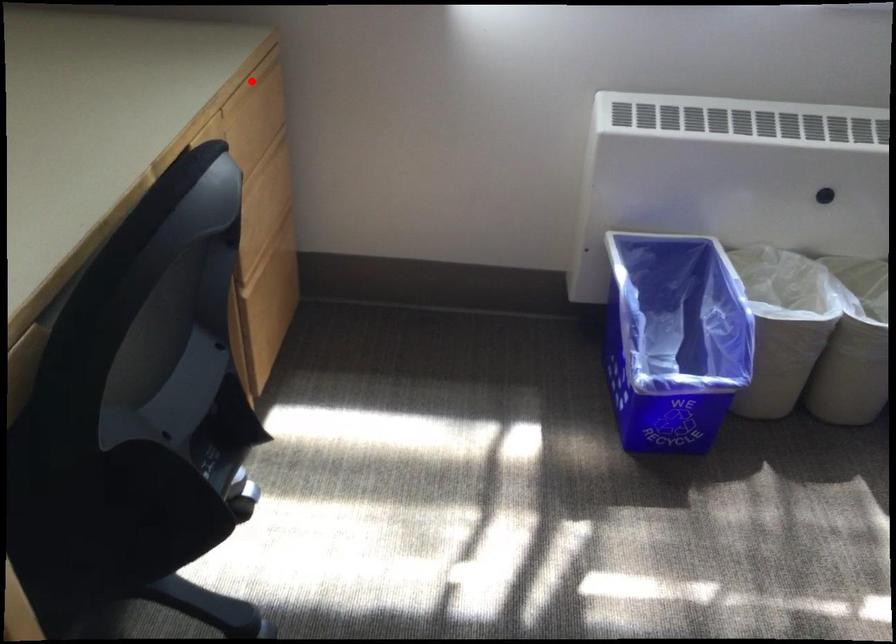
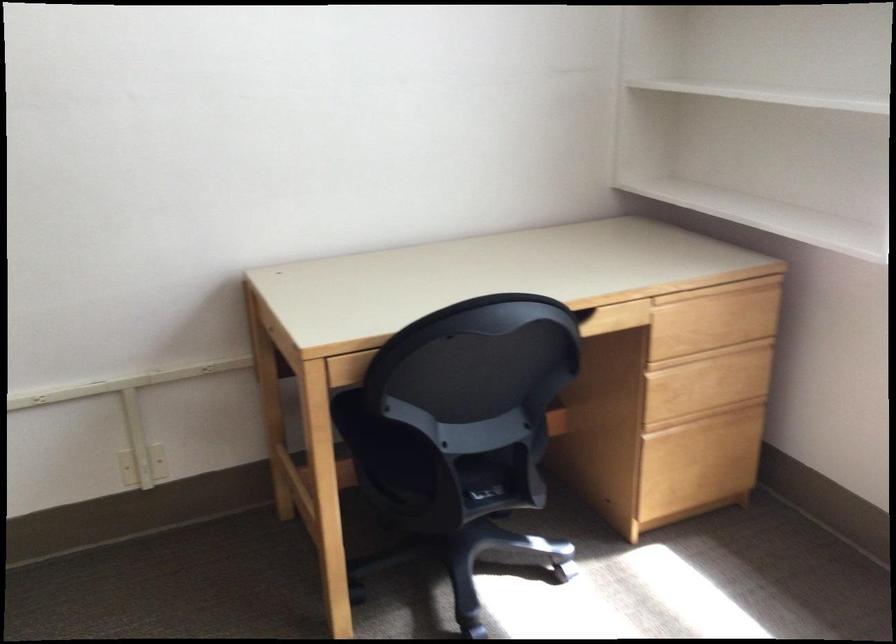
Question: I am providing you with two images of the same scene from different viewpoints. Given a red point in image1, look at the same physical point in image2. Is it:

Choices:
 (A) Closer to the viewpoint
 (B) Farther from the viewpoint

Answer: (B)